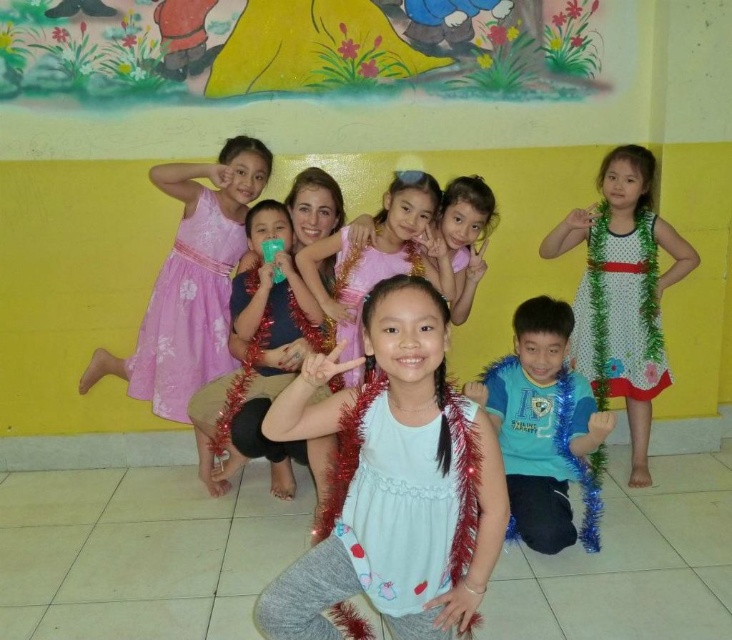
Question: Considering the relative positions of white dotted dress at right and matte blue shirt at center in the image provided, where is white dotted dress at right located with respect to matte blue shirt at center?

Choices:
 (A) below
 (B) above

Answer: (B)

Question: Among these objects, which one is nearest to the camera?

Choices:
 (A) matte blue shirt at center
 (B) white dotted fabric dress at upper right
 (C) blue t-shirt at center

Answer: (C)

Question: Based on their relative distances, which object is nearer to the white dotted dress at right?

Choices:
 (A) floral satin dress at center
 (B) shiny silver necklace at center
 (C) white dotted fabric dress at upper right
 (D) blue t-shirt at center

Answer: (C)

Question: Which is nearer to the white dotted fabric dress at upper right?

Choices:
 (A) floral satin dress at center
 (B) white tulle dress at center
 (C) shiny silver necklace at center
 (D) white dotted dress at right

Answer: (D)

Question: Can you confirm if white tulle dress at center is positioned to the left of white dotted fabric dress at upper right?

Choices:
 (A) no
 (B) yes

Answer: (B)

Question: Does white dotted dress at right appear under blue t-shirt at center?

Choices:
 (A) yes
 (B) no

Answer: (B)